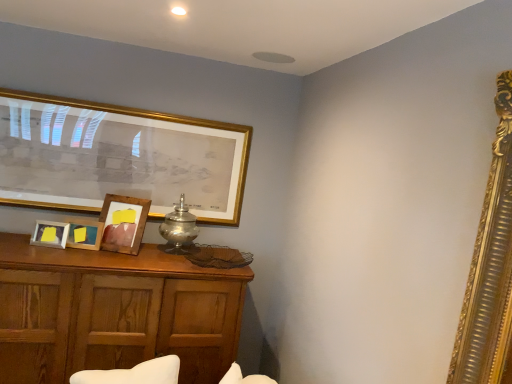
Question: Is silver metallic table lamp at center taller than wooden picture frame at center, which is the third picture frame in back-to-front order?

Choices:
 (A) yes
 (B) no

Answer: (A)

Question: Would you say silver metallic table lamp at center contains wooden picture frame at center, the 2th picture frame viewed from the front?

Choices:
 (A) yes
 (B) no

Answer: (B)

Question: Would you say silver metallic table lamp at center is outside wooden picture frame at center, the 2th picture frame viewed from the front?

Choices:
 (A) no
 (B) yes

Answer: (B)

Question: Does silver metallic table lamp at center turn towards wooden picture frame at center, which is the third picture frame in back-to-front order?

Choices:
 (A) yes
 (B) no

Answer: (B)

Question: Is silver metallic table lamp at center to the right of wooden picture frame at center, the 2th picture frame viewed from the front, from the viewer's perspective?

Choices:
 (A) no
 (B) yes

Answer: (B)

Question: Based on their positions, is wooden picture frame at center, the 2th picture frame viewed from the front, located to the left or right of wooden cabinet at lower left?

Choices:
 (A) left
 (B) right

Answer: (A)

Question: Is wooden picture frame at center, the 2th picture frame viewed from the front, situated inside wooden cabinet at lower left or outside?

Choices:
 (A) inside
 (B) outside

Answer: (B)

Question: From a real-world perspective, is wooden picture frame at center, which is the third picture frame in back-to-front order, positioned above or below wooden cabinet at lower left?

Choices:
 (A) below
 (B) above

Answer: (B)

Question: Is wooden picture frame at center, the 2th picture frame viewed from the front, taller or shorter than wooden cabinet at lower left?

Choices:
 (A) tall
 (B) short

Answer: (B)

Question: Is point (238, 168) positioned closer to the camera than point (125, 226)?

Choices:
 (A) farther
 (B) closer

Answer: (A)

Question: In terms of width, does gold-framed picture at upper left, the first picture frame from the back, look wider or thinner when compared to wooden picture frame at center, the third picture frame in the front-to-back sequence?

Choices:
 (A) wide
 (B) thin

Answer: (B)

Question: From a real-world perspective, relative to wooden picture frame at center, the third picture frame in the front-to-back sequence, is gold-framed picture at upper left, the fourth picture frame viewed from the front, vertically above or below?

Choices:
 (A) above
 (B) below

Answer: (A)

Question: Considering the positions of gold-framed picture at upper left, the first picture frame from the back, and wooden picture frame at center, the third picture frame in the front-to-back sequence, in the image, is gold-framed picture at upper left, the first picture frame from the back, taller or shorter than wooden picture frame at center, the third picture frame in the front-to-back sequence,?

Choices:
 (A) tall
 (B) short

Answer: (A)

Question: From the image's perspective, is wooden cabinet at lower left located above or below silver metallic table lamp at center?

Choices:
 (A) above
 (B) below

Answer: (B)

Question: Is point (210, 281) closer or farther from the camera than point (188, 211)?

Choices:
 (A) closer
 (B) farther

Answer: (A)